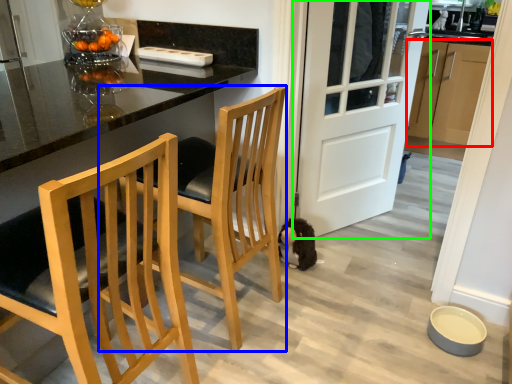
Question: Considering the real-world distances, which object is farthest from cabinetry (highlighted by a red box)? chair (highlighted by a blue box) or door (highlighted by a green box)?

Choices:
 (A) chair
 (B) door

Answer: (A)